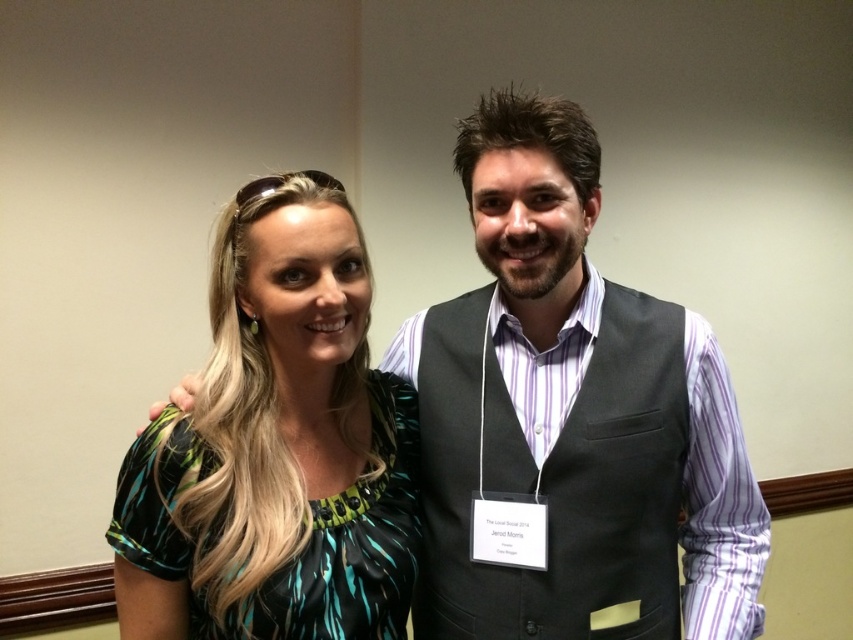
You are a photographer setting up for a photoshoot. You have two outfits to display in the studio. The matte black vest at center and the green printed fabric dress at left. The client wants to know which outfit takes up more space when displayed on a mannequin. Based on the image, which one requires more space?

The matte black vest at center is larger in size than the green printed fabric dress at left, so it requires more space when displayed on a mannequin.

You are a photographer trying to adjust the lighting for a photo shoot. You have two light sources placed at point (575, 186) and point (152, 467). Which light source is positioned further away from the camera lens?

Point (575, 186) is behind point (152, 467), so the light source at point (575, 186) is further away from the camera lens.

You are a photographer setting up for a group photo. You need to ensure that both the matte black vest at center and the green printed fabric dress at left are clearly visible in the frame. Based on their positions, which one might be partially obscured if you don not adjust the camera angle?

The green printed fabric dress at left is behind the matte black vest at center, so it might be partially obscured if the camera angle is not adjusted to ensure both are visible.